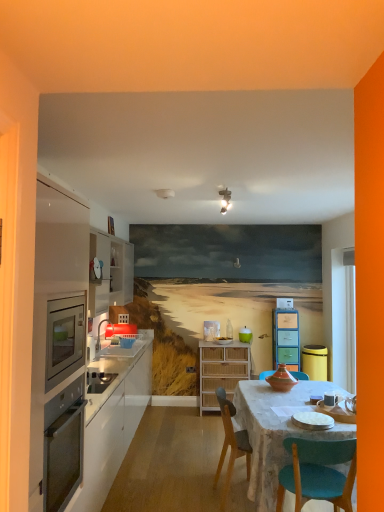
Question: Considering the relative sizes of wooden chair at center and matte white sink at left in the image provided, is wooden chair at center smaller than matte white sink at left?

Choices:
 (A) no
 (B) yes

Answer: (B)

Question: Can you confirm if wooden chair at center is bigger than matte white sink at left?

Choices:
 (A) no
 (B) yes

Answer: (A)

Question: From a real-world perspective, is wooden chair at center over matte white sink at left?

Choices:
 (A) no
 (B) yes

Answer: (A)

Question: From the image's perspective, would you say wooden chair at center is shown under matte white sink at left?

Choices:
 (A) no
 (B) yes

Answer: (B)

Question: From a real-world perspective, is wooden chair at center under matte white sink at left?

Choices:
 (A) no
 (B) yes

Answer: (B)

Question: Is point (223, 366) positioned closer to the camera than point (119, 459)?

Choices:
 (A) farther
 (B) closer

Answer: (A)

Question: From their relative heights in the image, would you say bamboo cabinet at center, acting as the second cabinetry starting from the back, is taller or shorter than white glossy cabinetry at left, which ranks as the 2th cabinetry in front-to-back order?

Choices:
 (A) tall
 (B) short

Answer: (B)

Question: Which is correct: bamboo cabinet at center, acting as the 2th cabinetry starting from the right, is inside white glossy cabinetry at left, the 4th cabinetry when ordered from right to left, or outside of it?

Choices:
 (A) outside
 (B) inside

Answer: (A)

Question: In terms of width, does bamboo cabinet at center, positioned as the 3th cabinetry in left-to-right order, look wider or thinner when compared to white glossy cabinetry at left, the 4th cabinetry when ordered from right to left?

Choices:
 (A) wide
 (B) thin

Answer: (B)

Question: Looking at their shapes, would you say satin white cabinetry at left, the first cabinetry positioned from the front, is wider or thinner than matte white sink at left?

Choices:
 (A) wide
 (B) thin

Answer: (B)

Question: From a real-world perspective, is satin white cabinetry at left, which is counted as the 2th cabinetry, starting from the left, physically located above or below matte white sink at left?

Choices:
 (A) above
 (B) below

Answer: (A)

Question: From the image's perspective, is satin white cabinetry at left, which is counted as the 2th cabinetry, starting from the left, positioned above or below matte white sink at left?

Choices:
 (A) above
 (B) below

Answer: (A)

Question: Considering the positions of point (52, 467) and point (114, 332), is point (52, 467) closer or farther from the camera than point (114, 332)?

Choices:
 (A) farther
 (B) closer

Answer: (B)

Question: Is marble table at center wider or thinner than satin white cabinetry at left, which is counted as the 2th cabinetry, starting from the left?

Choices:
 (A) wide
 (B) thin

Answer: (A)

Question: Looking at the image, does marble table at center seem bigger or smaller compared to satin white cabinetry at left, which ranks as the third cabinetry in right-to-left order?

Choices:
 (A) big
 (B) small

Answer: (A)